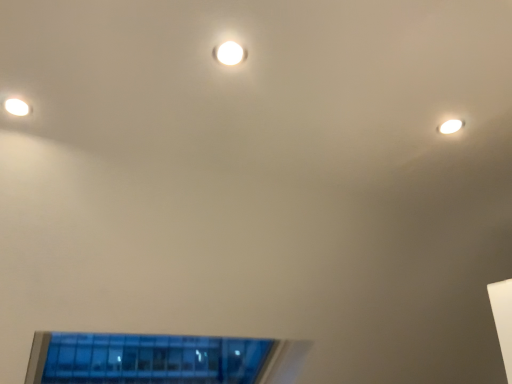
The height and width of the screenshot is (384, 512). Describe the element at coordinates (17, 107) in the screenshot. I see `matte white droplight at upper left` at that location.

Find the location of a particular element. The image size is (512, 384). matte white droplight at upper left is located at coordinates (17, 107).

The width and height of the screenshot is (512, 384). Find the location of `matte white droplight at upper left`. matte white droplight at upper left is located at coordinates (17, 107).